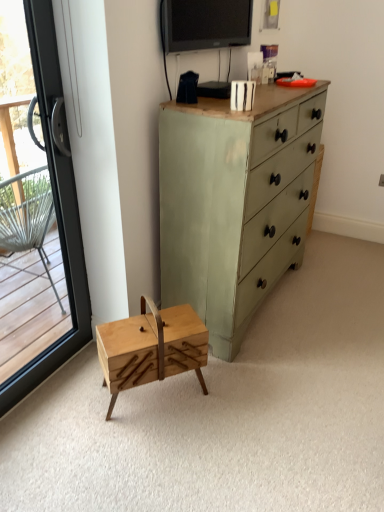
Question: Considering the relative sizes of transparent glass door at left and green painted wood chest of drawers at center in the image provided, is transparent glass door at left wider than green painted wood chest of drawers at center?

Choices:
 (A) yes
 (B) no

Answer: (B)

Question: From the image's perspective, is transparent glass door at left under green painted wood chest of drawers at center?

Choices:
 (A) no
 (B) yes

Answer: (B)

Question: Is transparent glass door at left taller than green painted wood chest of drawers at center?

Choices:
 (A) no
 (B) yes

Answer: (B)

Question: Can green painted wood chest of drawers at center be found inside transparent glass door at left?

Choices:
 (A) no
 (B) yes

Answer: (A)

Question: Can you confirm if transparent glass door at left is positioned to the left of green painted wood chest of drawers at center?

Choices:
 (A) no
 (B) yes

Answer: (B)

Question: Considering the positions of point (46, 53) and point (249, 315), is point (46, 53) closer or farther from the camera than point (249, 315)?

Choices:
 (A) closer
 (B) farther

Answer: (A)

Question: In the image, is transparent glass door at left on the left side or the right side of green painted wood chest of drawers at center?

Choices:
 (A) left
 (B) right

Answer: (A)

Question: Is transparent glass door at left taller or shorter than green painted wood chest of drawers at center?

Choices:
 (A) short
 (B) tall

Answer: (B)

Question: From a real-world perspective, relative to green painted wood chest of drawers at center, is transparent glass door at left vertically above or below?

Choices:
 (A) above
 (B) below

Answer: (A)

Question: Considering their positions, is transparent glass door at left located in front of or behind matte black tv at upper center?

Choices:
 (A) front
 (B) behind

Answer: (A)

Question: From the image's perspective, is transparent glass door at left positioned above or below matte black tv at upper center?

Choices:
 (A) below
 (B) above

Answer: (A)

Question: Looking at their shapes, would you say transparent glass door at left is wider or thinner than matte black tv at upper center?

Choices:
 (A) thin
 (B) wide

Answer: (B)

Question: Is point (28, 8) positioned closer to the camera than point (185, 38)?

Choices:
 (A) closer
 (B) farther

Answer: (A)

Question: Would you say natural wood sewing box at center is inside or outside green painted wood chest of drawers at center?

Choices:
 (A) outside
 (B) inside

Answer: (A)

Question: Considering the positions of point (140, 366) and point (248, 311), is point (140, 366) closer or farther from the camera than point (248, 311)?

Choices:
 (A) closer
 (B) farther

Answer: (A)